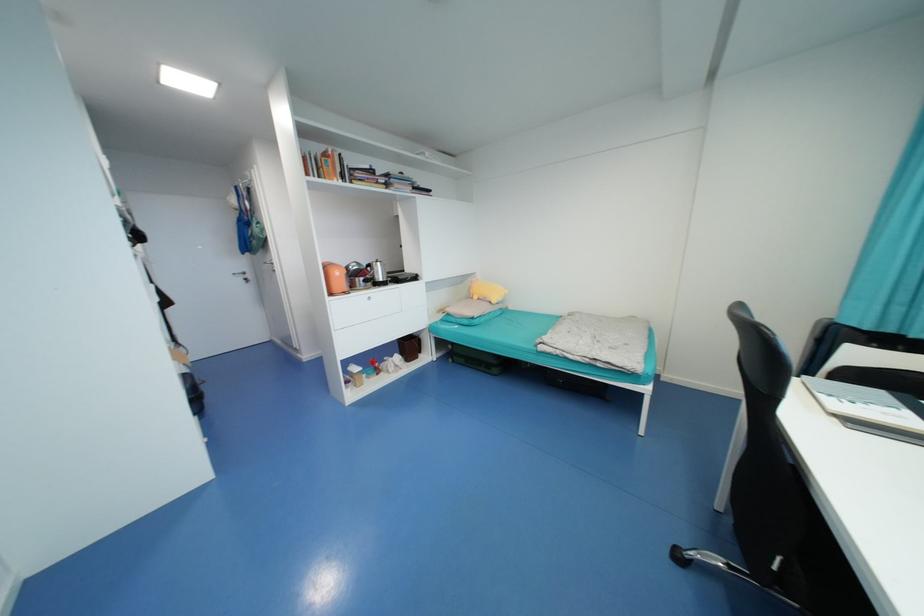
This screenshot has height=616, width=924. Describe the element at coordinates (241, 276) in the screenshot. I see `the silver door handle` at that location.